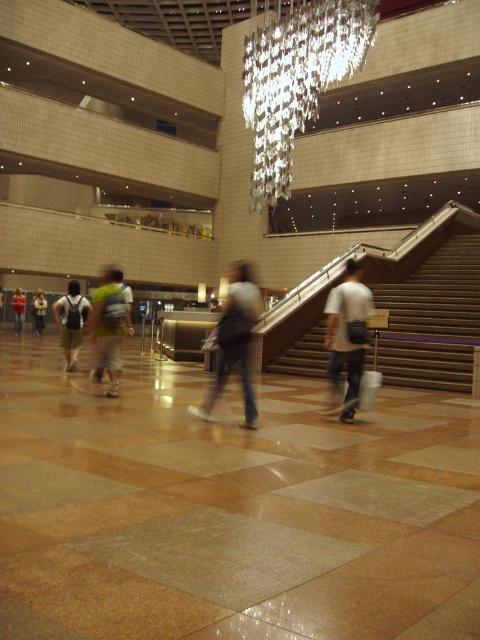
Does point (84, 310) come farther from viewer compared to point (40, 323)?

That is False.

Between point (75, 294) and point (37, 317), which one is positioned in front?

Positioned in front is point (75, 294).

Describe the element at coordinates (71, 321) in the screenshot. I see `matte black backpack at center` at that location.

Image resolution: width=480 pixels, height=640 pixels. Identify the location of matte black backpack at center. (71, 321).

You are a GUI agent. You are given a task and a screenshot of the screen. Output one action in this format:
    pyautogui.click(x=<x>, y=<y>)
    Task: Click on the light brown leather jacket at lower left
    The width and height of the screenshot is (480, 640).
    Given the screenshot: What is the action you would take?
    tap(38, 312)

Is point (33, 324) less distant than point (0, 312)?

No, it is not.

Is point (40, 296) positioned after point (1, 300)?

That is False.

Where is `light brown leather jacket at lower left`? light brown leather jacket at lower left is located at coordinates (38, 312).

Which is below, matte black backpack at center or light brown leather backpack at lower left?

matte black backpack at center is below.

Who is taller, matte black backpack at center or light brown leather backpack at lower left?

With more height is light brown leather backpack at lower left.

What do you see at coordinates (71, 321) in the screenshot? This screenshot has height=640, width=480. I see `matte black backpack at center` at bounding box center [71, 321].

Find the location of `matte black backpack at center`. matte black backpack at center is located at coordinates (71, 321).